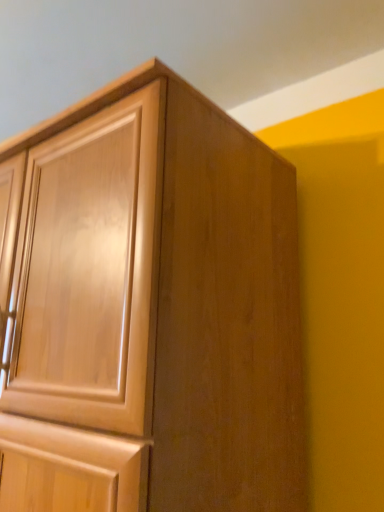
What do you see at coordinates (150, 310) in the screenshot?
I see `glossy wood cupboard at upper center` at bounding box center [150, 310].

Measure the distance between point (x=144, y=108) and camera.

Point (x=144, y=108) and camera are 25.98 inches apart from each other.

Locate an element on the screen. glossy wood cupboard at upper center is located at coordinates (150, 310).

The width and height of the screenshot is (384, 512). What are the coordinates of `glossy wood cupboard at upper center` in the screenshot? It's located at [x=150, y=310].